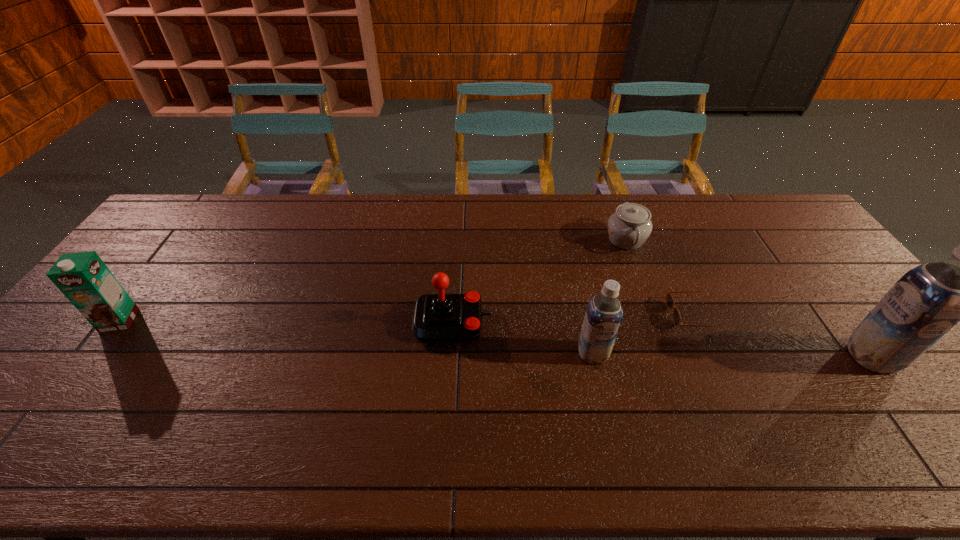
What are the coordinates of `free space for a new soya milk on the left` in the screenshot? It's located at (318, 350).